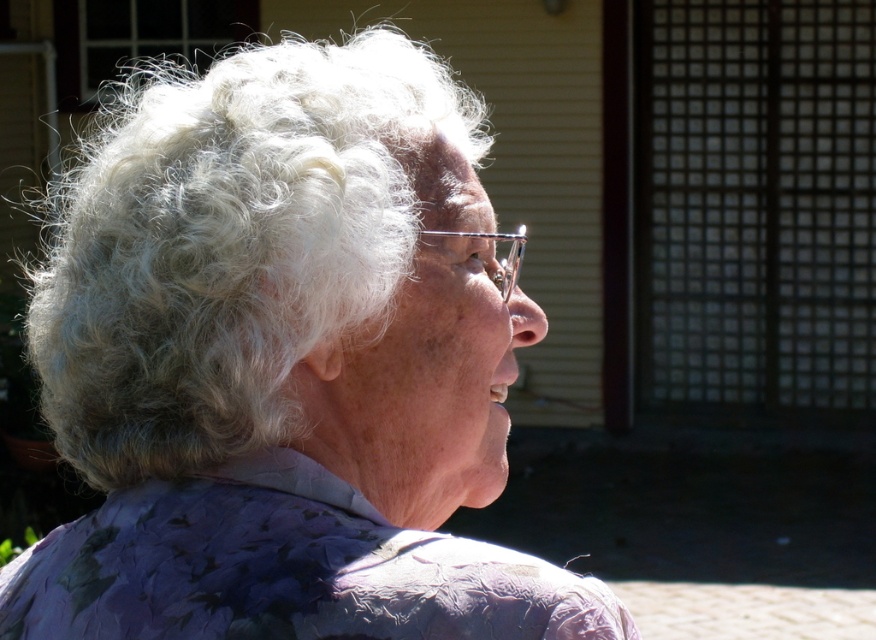
Question: Which point is closer to the camera taking this photo?

Choices:
 (A) [x=414, y=237]
 (B) [x=470, y=577]

Answer: (B)

Question: Can you confirm if white curly hair at upper left is positioned to the left of purple floral fabric at lower center?

Choices:
 (A) no
 (B) yes

Answer: (A)

Question: Where is white curly hair at upper left located in relation to purple floral fabric at lower center in the image?

Choices:
 (A) above
 (B) below

Answer: (A)

Question: Can you confirm if white curly hair at upper left is wider than purple floral fabric at lower center?

Choices:
 (A) no
 (B) yes

Answer: (A)

Question: Which of the following is the farthest from the observer?

Choices:
 (A) white curly hair at upper left
 (B) purple floral fabric at lower center

Answer: (A)

Question: Which point is closer to the camera?

Choices:
 (A) purple floral fabric at lower center
 (B) white curly hair at upper left

Answer: (A)